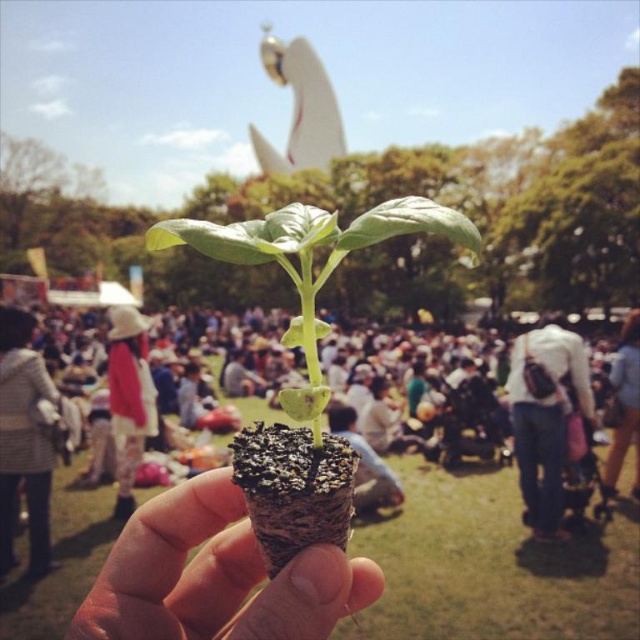
You are standing at the picnic area and want to walk towards the hand holding the small plant. There are two points marked in the image, point A at coordinates point A is at point (531, 504) and point B at point (634, 349). Which point should you walk towards to get closer to the hand holding the small plant?

You should walk towards point A at point (531, 504) because it is in front of point B at point (634, 349), meaning it is closer to your current position at the picnic area.

You are at a community event and want to find a seat. You notice a white cotton hat at center and denim shorts at lower right. Which object is taller?

The white cotton hat at center is much taller than the denim shorts at lower right.

You are organizing a clothing donation drive and need to categorize items based on their size. You have a denim jacket at center and a striped sweater at lower left. Which item should you place in the large size bin?

The striped sweater at lower left should be placed in the large size bin because it is larger than the denim jacket at center.